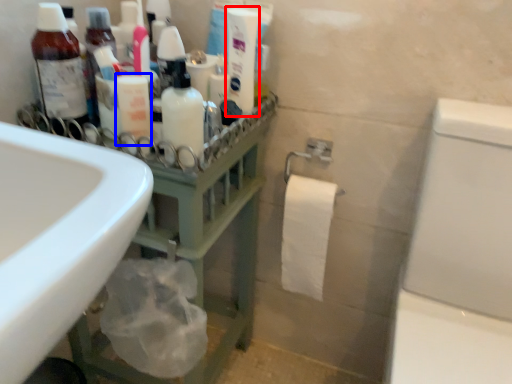
Question: Which object appears farthest to the camera in this image, cleaning product (highlighted by a red box) or toiletry (highlighted by a blue box)?

Choices:
 (A) cleaning product
 (B) toiletry

Answer: (A)